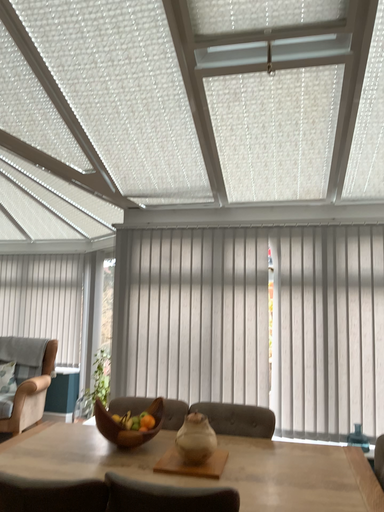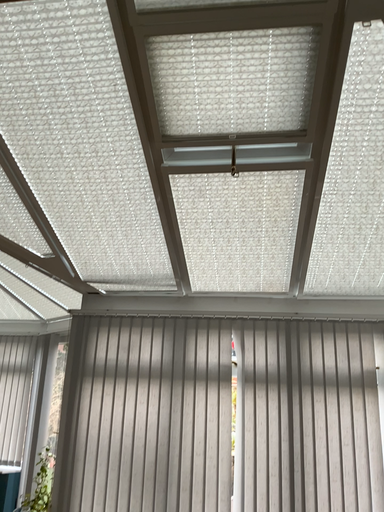
Question: Which way did the camera rotate in the video?

Choices:
 (A) rotated downward
 (B) rotated upward

Answer: (B)